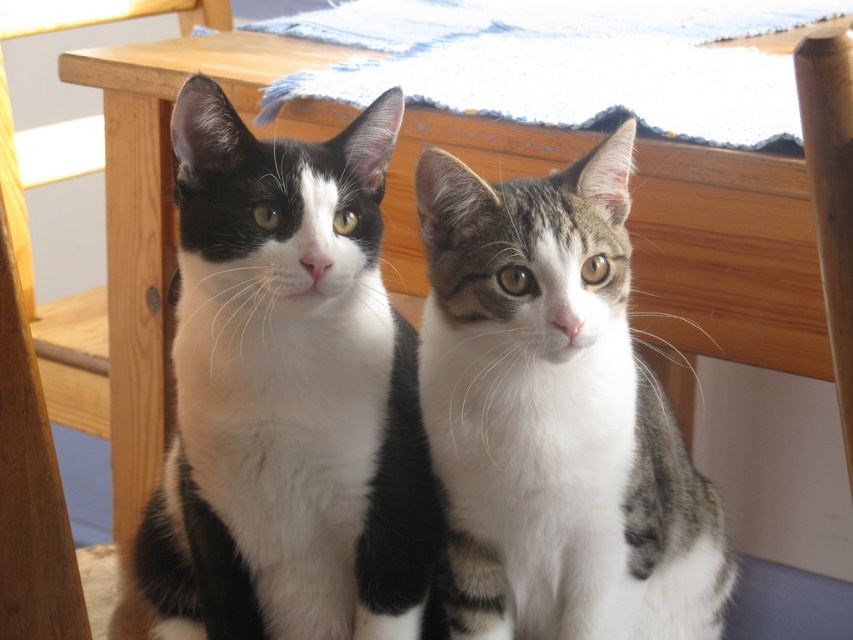
Question: Is black and white fur cat at center bigger than wooden chair at left?

Choices:
 (A) no
 (B) yes

Answer: (A)

Question: Can you confirm if wooden chair at left is smaller than wooden chair at right?

Choices:
 (A) no
 (B) yes

Answer: (A)

Question: Which point is closer to the camera?

Choices:
 (A) (851, 355)
 (B) (65, 172)
 (C) (165, 568)

Answer: (A)

Question: Which point is closer to the camera taking this photo?

Choices:
 (A) (811, 160)
 (B) (477, 609)
 (C) (38, 320)

Answer: (A)

Question: Which object is farther from the camera taking this photo?

Choices:
 (A) wooden chair at left
 (B) wooden chair at right
 (C) black and white fur cat at center
 (D) tabby fur cat at center

Answer: (A)

Question: Does black and white fur cat at center lie in front of wooden chair at right?

Choices:
 (A) yes
 (B) no

Answer: (B)